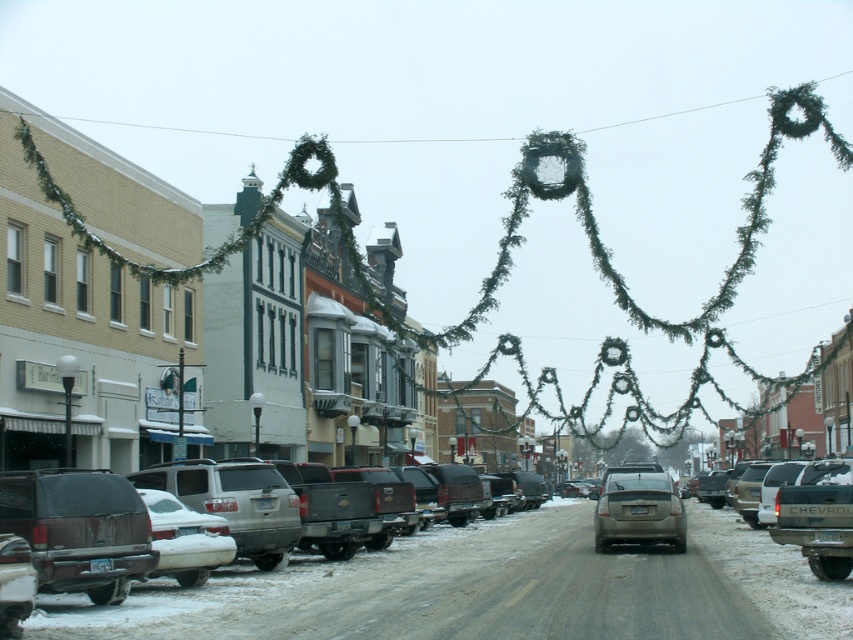
Question: Can you confirm if dark brown matte suv at left is smaller than matte gray sedan at center?

Choices:
 (A) yes
 (B) no

Answer: (A)

Question: Which point is farther to the camera?

Choices:
 (A) matte gray sedan at center
 (B) dark brown matte suv at left

Answer: (A)

Question: Among these points, which one is farthest from the camera?

Choices:
 (A) (33, 545)
 (B) (602, 483)

Answer: (B)

Question: Does dark brown matte suv at left have a larger size compared to matte gray sedan at center?

Choices:
 (A) yes
 (B) no

Answer: (B)

Question: Which point is closer to the camera taking this photo?

Choices:
 (A) (78, 582)
 (B) (631, 490)

Answer: (A)

Question: Does dark brown matte suv at left appear under matte gray sedan at center?

Choices:
 (A) no
 (B) yes

Answer: (A)